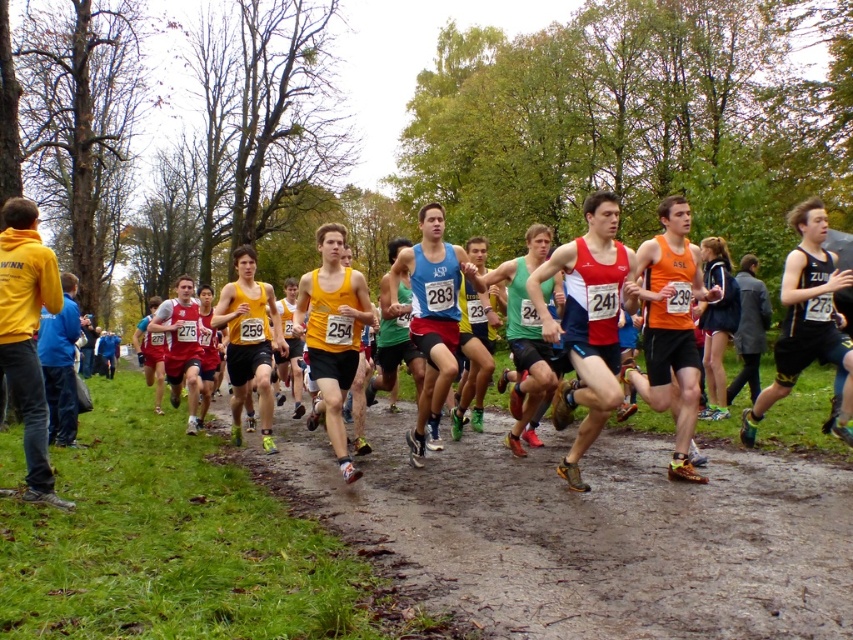
You are a race official trying to ensure runners are spaced properly for safety. The minimum required distance between runners is 4 meters. You see the yellow hoodie at left and the matte red tank top at center. Are they maintaining the required distance?

The yellow hoodie at left and the matte red tank top at center are 4.44 meters apart, which exceeds the minimum required distance of 4 meters, so they are maintaining the required distance.

You are a photographer positioned at the starting line of the cross country race. You need to capture a photo that includes both the black jersey at center and the matte red tank top at center. Given their sizes, which runner should you focus on to ensure both are fully visible in your frame?

The black jersey at center has a lesser width compared to the matte red tank top at center, so you should focus on the matte red tank top at center as it is wider and will ensure both are visible in the frame.